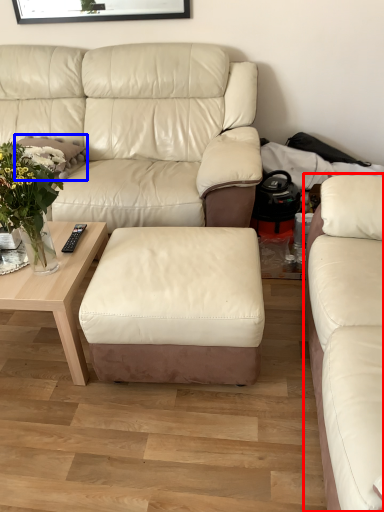
Question: Which of the following is the closest to the observer, studio couch (highlighted by a red box) or pillow (highlighted by a blue box)?

Choices:
 (A) studio couch
 (B) pillow

Answer: (A)